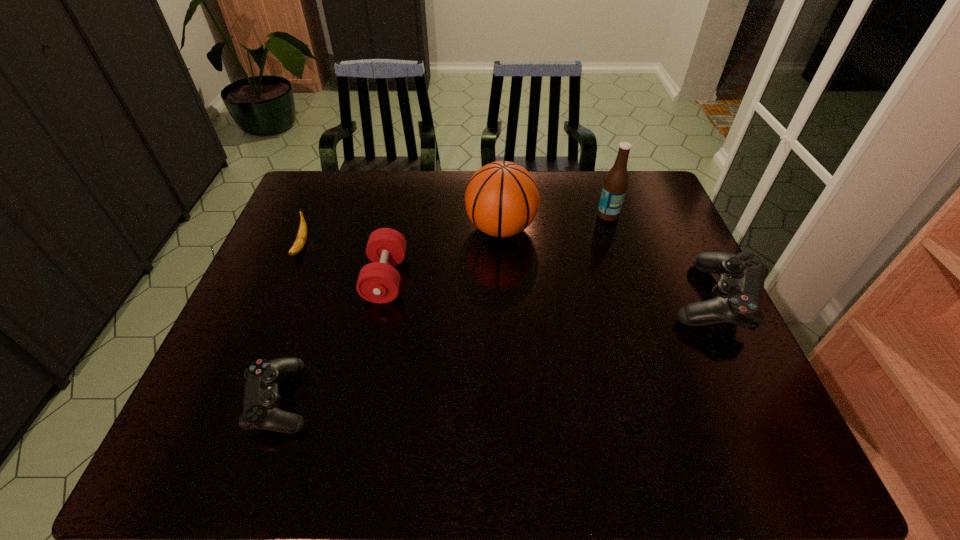
Find the location of a particular element. vacant space located 0.260m on the front of the second object from right to left is located at coordinates (630, 282).

Where is `free region located on the peel of the leftmost object from the top`? free region located on the peel of the leftmost object from the top is located at coordinates (285, 285).

Find the location of a particular element. vacant space located 0.390m on the front of the basketball is located at coordinates (508, 369).

At what (x,y) coordinates should I click in order to perform the action: click on vacant position located 0.140m on the right of the dumbbell. Please return your answer as a coordinate pair (x, y). Looking at the image, I should click on (456, 279).

Locate an element on the screen. The width and height of the screenshot is (960, 540). beer bottle located at the far edge is located at coordinates point(615,185).

In order to click on basketball positioned at the far edge in this screenshot , I will do `click(502, 198)`.

Locate an element on the screen. The image size is (960, 540). object at the near edge is located at coordinates (261, 401).

This screenshot has width=960, height=540. I want to click on control present at the left edge, so click(261, 401).

You are a GUI agent. You are given a task and a screenshot of the screen. Output one action in this format:
    pyautogui.click(x=<x>, y=<y>)
    Task: Click on the banana that is at the left edge
    
    Given the screenshot: What is the action you would take?
    pyautogui.click(x=299, y=243)

You are a GUI agent. You are given a task and a screenshot of the screen. Output one action in this format:
    pyautogui.click(x=<x>, y=<y>)
    Task: Click on the object located at the right edge
    This screenshot has width=960, height=540.
    Given the screenshot: What is the action you would take?
    pyautogui.click(x=738, y=295)